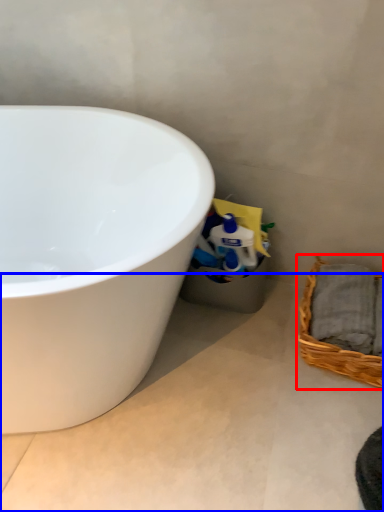
Question: Which point is closer to the camera, picnic basket (highlighted by a red box) or concrete (highlighted by a blue box)?

Choices:
 (A) picnic basket
 (B) concrete

Answer: (B)